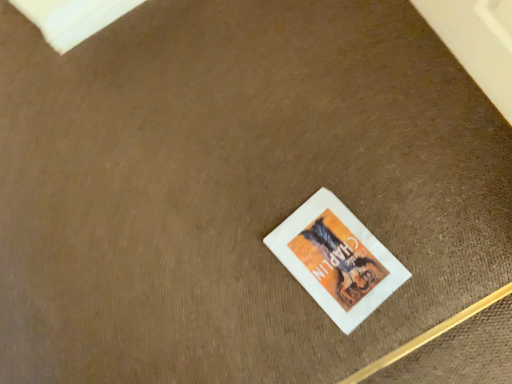
This screenshot has width=512, height=384. Find the location of `free point below white paper book at center (from a real-world perspective)`. free point below white paper book at center (from a real-world perspective) is located at coordinates (336, 254).